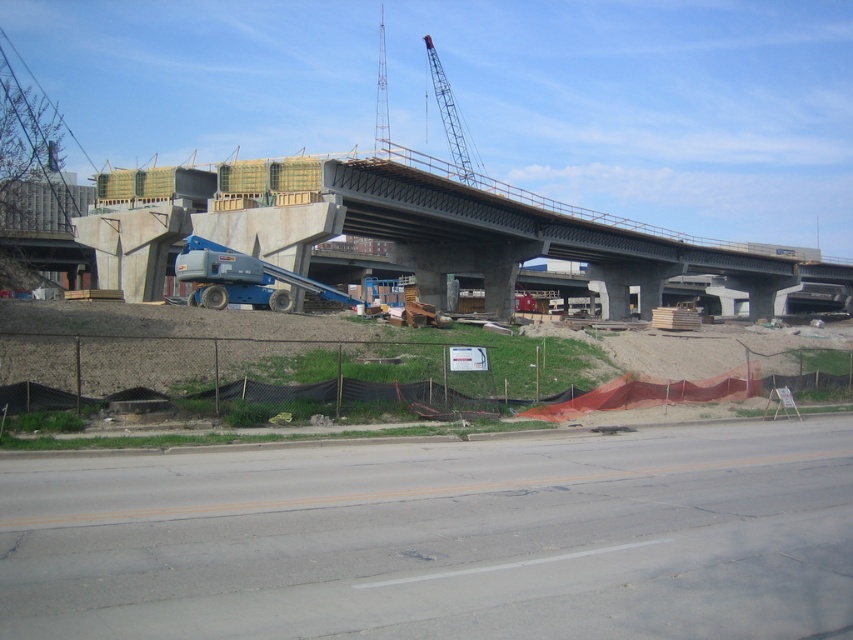
You are a delivery truck driver approaching the construction site. You need to determine the safest path to navigate around the gray asphalt highway at lower center and the metallic gray crane at upper center. Which object is closer to you, and should you adjust your route accordingly?

The gray asphalt highway at lower center is closer to the viewer than the metallic gray crane at upper center. Since the highway is closer, you should adjust your route to account for its proximity, ensuring safe passage around it while avoiding the crane further ahead.

You are a construction worker who needs to place a new steel beam. The beam is too heavy to lift manually. You have a metallic gray crane at upper center and concrete at center. Which object should you use to position the beam safely?

→ You should use the metallic gray crane at upper center to position the beam safely because the concrete at center is below it and cannot lift heavy objects.